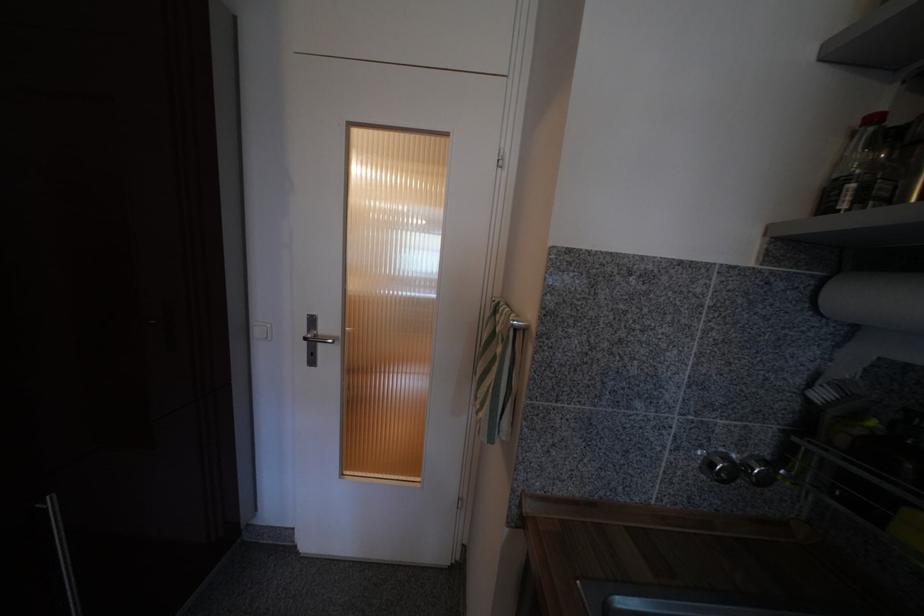
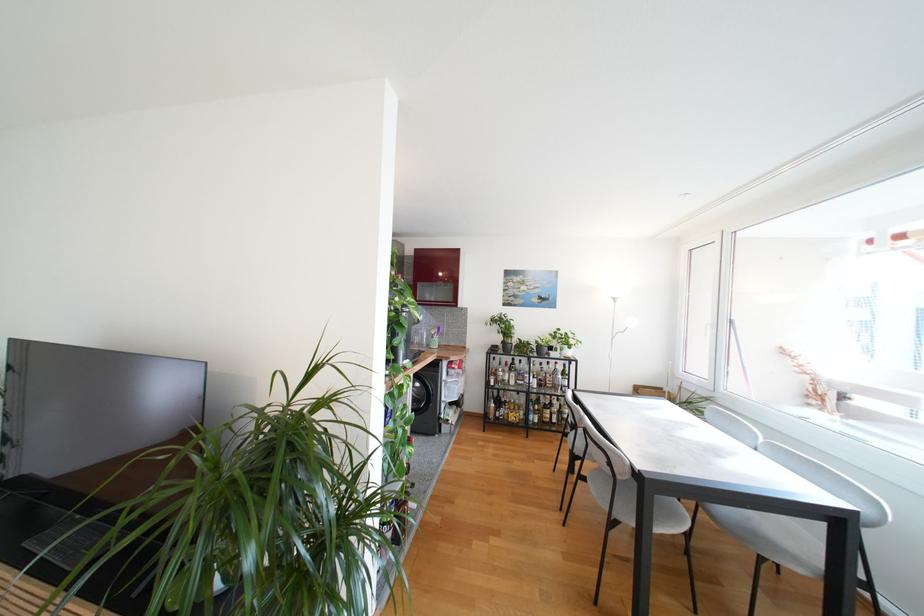
Question: I am providing you with two images of the same scene from different viewpoints. Please identify which objects are invisible in image2.

Choices:
 (A) glass bottle
 (B) white window handle
 (C) clear plastic bottle
 (D) green bucket handle

Answer: (C)